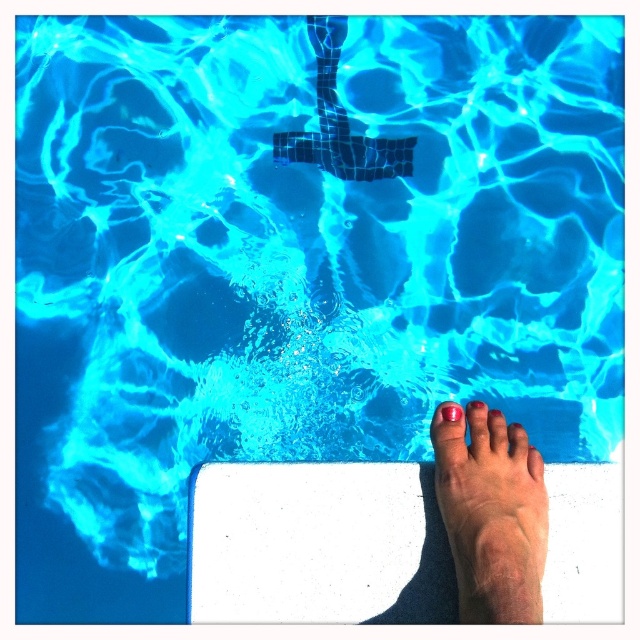
Is smooth skin foot at lower right smaller than pink glossy toe at lower right?

No.

Can you confirm if smooth skin foot at lower right is thinner than pink glossy toe at lower right?

No, smooth skin foot at lower right is not thinner than pink glossy toe at lower right.

Does point (486, 490) come closer to viewer compared to point (452, 404)?

That is True.

The image size is (640, 640). Identify the location of smooth skin foot at lower right. (490, 515).

Can you confirm if pink matte nail at center is bigger than pink glossy toe at lower right?

Correct, pink matte nail at center is larger in size than pink glossy toe at lower right.

Does pink matte nail at center lie in front of pink glossy toe at lower right?

Yes, pink matte nail at center is in front of pink glossy toe at lower right.

Between point (538, 470) and point (436, 406), which one is positioned behind?

Point (436, 406)

You are a GUI agent. You are given a task and a screenshot of the screen. Output one action in this format:
    pyautogui.click(x=<x>, y=<y>)
    Task: Click on the pink matte nail at center
    The width and height of the screenshot is (640, 640).
    Given the screenshot: What is the action you would take?
    pyautogui.click(x=534, y=464)

Consider the image. Who is positioned more to the right, smooth skin foot at lower right or pink matte nail at center?

Positioned to the right is pink matte nail at center.

Between smooth skin foot at lower right and pink matte nail at center, which one is positioned higher?

pink matte nail at center

The width and height of the screenshot is (640, 640). I want to click on smooth skin foot at lower right, so click(490, 515).